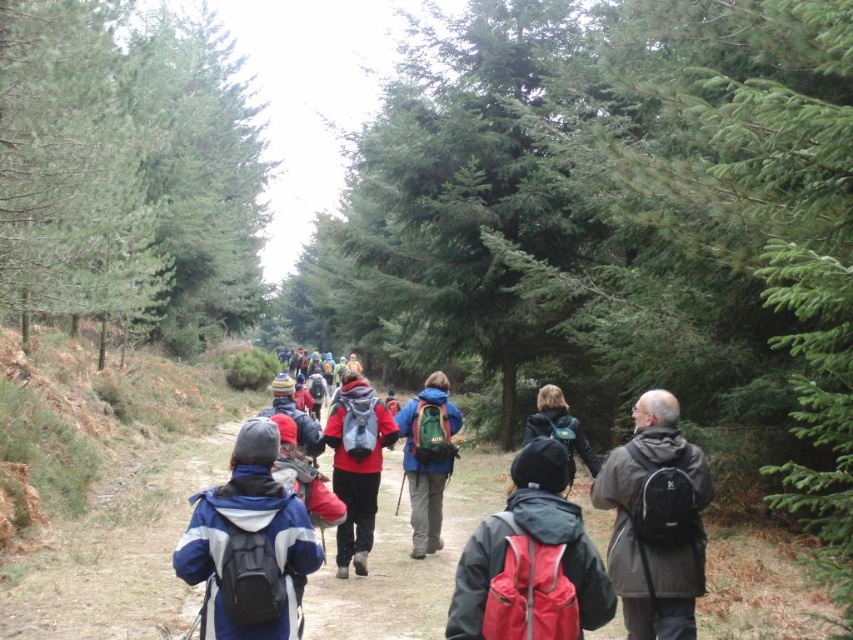
Question: Does red backpack at center appear under green fabric backpack at center?

Choices:
 (A) yes
 (B) no

Answer: (B)

Question: Among these points, which one is farthest from the camera?

Choices:
 (A) (215, 509)
 (B) (659, 506)

Answer: (B)

Question: Which object is farther from the camera taking this photo?

Choices:
 (A) matte black backpack at center
 (B) matte red jacket at center
 (C) green fabric backpack at center

Answer: (C)

Question: From the image, what is the correct spatial relationship of green matte tree at left in relation to matte blue jacket at center?

Choices:
 (A) below
 (B) above

Answer: (B)

Question: From the image, what is the correct spatial relationship of green matte tree at left in relation to matte red jacket at center?

Choices:
 (A) left
 (B) right

Answer: (A)

Question: Which of the following is the farthest from the observer?

Choices:
 (A) (302, 528)
 (B) (341, 444)

Answer: (B)